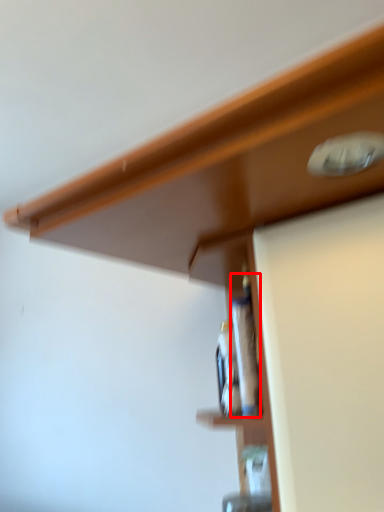
Question: From the image's perspective, where is bottle (annotated by the red box) located relative to bottle?

Choices:
 (A) below
 (B) above

Answer: (B)